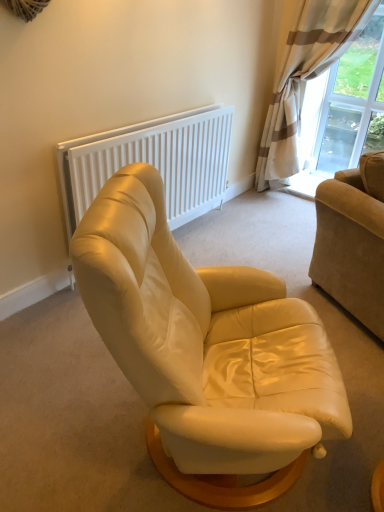
Question: Can we say beige corduroy couch at right lies outside matte cream leather armchair at center?

Choices:
 (A) yes
 (B) no

Answer: (A)

Question: From a real-world perspective, is beige corduroy couch at right under matte cream leather armchair at center?

Choices:
 (A) no
 (B) yes

Answer: (A)

Question: Can you confirm if beige corduroy couch at right is positioned to the right of matte cream leather armchair at center?

Choices:
 (A) yes
 (B) no

Answer: (A)

Question: Is beige corduroy couch at right looking in the opposite direction of matte cream leather armchair at center?

Choices:
 (A) no
 (B) yes

Answer: (A)

Question: Is beige corduroy couch at right far from matte cream leather armchair at center?

Choices:
 (A) no
 (B) yes

Answer: (A)

Question: Considering the positions of white matte radiator at upper center and beige striped curtain at upper right in the image, is white matte radiator at upper center taller or shorter than beige striped curtain at upper right?

Choices:
 (A) short
 (B) tall

Answer: (A)

Question: In terms of size, does white matte radiator at upper center appear bigger or smaller than beige striped curtain at upper right?

Choices:
 (A) small
 (B) big

Answer: (A)

Question: Considering their positions, is white matte radiator at upper center located in front of or behind beige striped curtain at upper right?

Choices:
 (A) behind
 (B) front

Answer: (B)

Question: Is white matte radiator at upper center wider or thinner than beige striped curtain at upper right?

Choices:
 (A) thin
 (B) wide

Answer: (A)

Question: Is point (175, 480) closer or farther from the camera than point (291, 12)?

Choices:
 (A) closer
 (B) farther

Answer: (A)

Question: Considering the positions of matte cream leather armchair at center and beige striped curtain at upper right in the image, is matte cream leather armchair at center taller or shorter than beige striped curtain at upper right?

Choices:
 (A) tall
 (B) short

Answer: (B)

Question: From the image's perspective, is matte cream leather armchair at center positioned above or below beige striped curtain at upper right?

Choices:
 (A) above
 (B) below

Answer: (B)

Question: Is matte cream leather armchair at center situated inside beige striped curtain at upper right or outside?

Choices:
 (A) outside
 (B) inside

Answer: (A)

Question: Is point (342, 22) closer or farther from the camera than point (380, 55)?

Choices:
 (A) closer
 (B) farther

Answer: (A)

Question: Would you say beige striped curtain at upper right is inside or outside transparent glass window at upper right?

Choices:
 (A) outside
 (B) inside

Answer: (A)